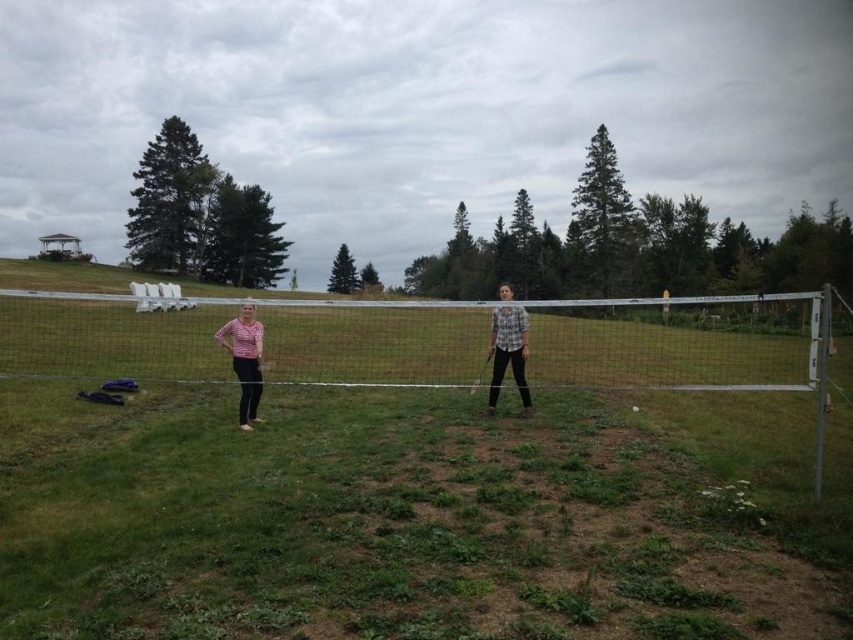
Between point (480, 355) and point (497, 307), which one is positioned in front?

Point (497, 307)

Who is positioned more to the right, white mesh net at center or plaid shirt at center?

From the viewer's perspective, plaid shirt at center appears more on the right side.

The height and width of the screenshot is (640, 853). I want to click on white mesh net at center, so coord(550,340).

Is white mesh net at center to the left of striped cotton shirt at left from the viewer's perspective?

In fact, white mesh net at center is to the right of striped cotton shirt at left.

Is point (187, 362) behind point (244, 419)?

That is True.

Does point (155, 333) come closer to viewer compared to point (228, 332)?

No, it is behind (228, 332).

At what (x,y) coordinates should I click in order to perform the action: click on white mesh net at center. Please return your answer as a coordinate pair (x, y). The image size is (853, 640). Looking at the image, I should click on (550, 340).

Who is lower down, plaid shirt at center or striped cotton shirt at left?

striped cotton shirt at left is below.

Does plaid shirt at center have a lesser width compared to striped cotton shirt at left?

In fact, plaid shirt at center might be wider than striped cotton shirt at left.

This screenshot has width=853, height=640. In order to click on plaid shirt at center in this screenshot , I will do `click(508, 353)`.

Find the location of a particular element. This screenshot has width=853, height=640. plaid shirt at center is located at coordinates (508, 353).